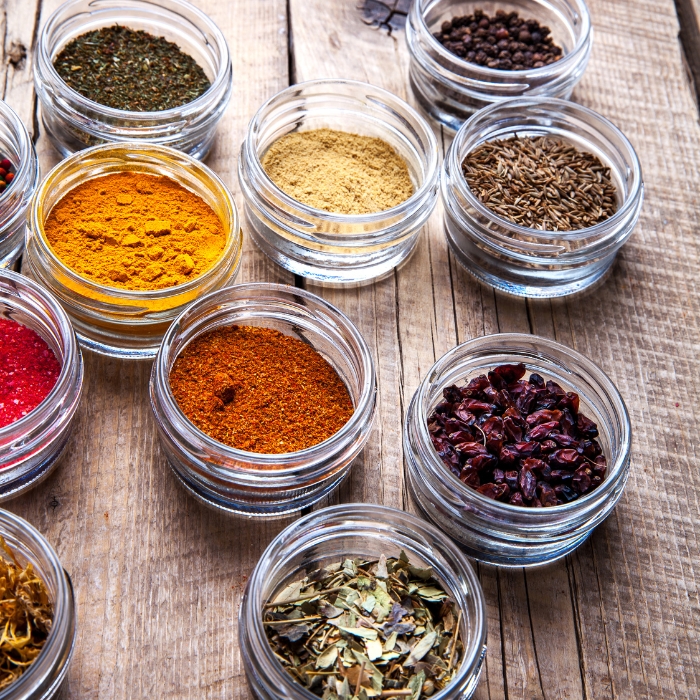
Locate an element on the screen. The width and height of the screenshot is (700, 700). knots in wood is located at coordinates (14, 55), (388, 10).